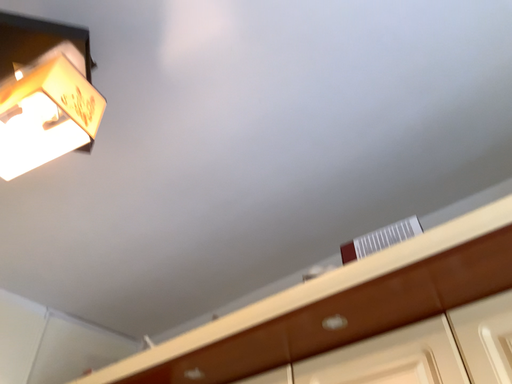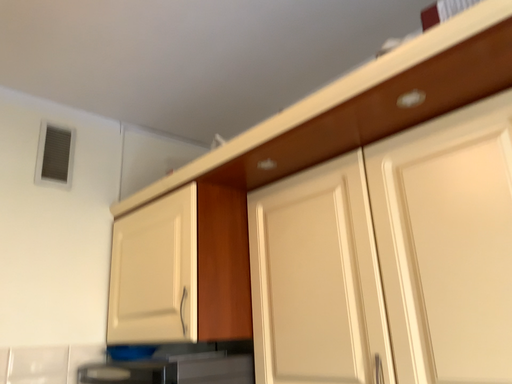
Question: How did the camera likely rotate when shooting the video?

Choices:
 (A) rotated right
 (B) rotated left

Answer: (B)